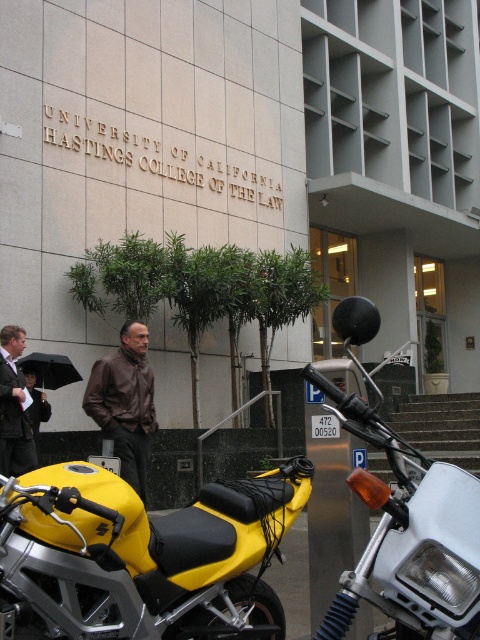
Does point (139, 380) lie behind point (17, 428)?

That is False.

Does brown leather jacket at center lie behind brown leather jacket at lower left?

No.

Between point (105, 371) and point (0, 438), which one is positioned behind?

The point (0, 438) is more distant.

This screenshot has width=480, height=640. Identify the location of brown leather jacket at center. (124, 403).

Who is positioned more to the left, yellow matte motorcycle at center or brown leather jacket at center?

brown leather jacket at center is more to the left.

Is yellow matte motorcycle at center below brown leather jacket at center?

No, yellow matte motorcycle at center is not below brown leather jacket at center.

Identify the location of yellow matte motorcycle at center. (405, 518).

Is the position of yellow matte/synthetic motorcycle at center more distant than that of yellow matte motorcycle at center?

Yes, yellow matte/synthetic motorcycle at center is further from the viewer.

Can you confirm if yellow matte/synthetic motorcycle at center is shorter than yellow matte motorcycle at center?

Indeed, yellow matte/synthetic motorcycle at center has a lesser height compared to yellow matte motorcycle at center.

Is point (105, 509) more distant than point (385, 544)?

Yes, it is.

I want to click on yellow matte/synthetic motorcycle at center, so pos(144,556).